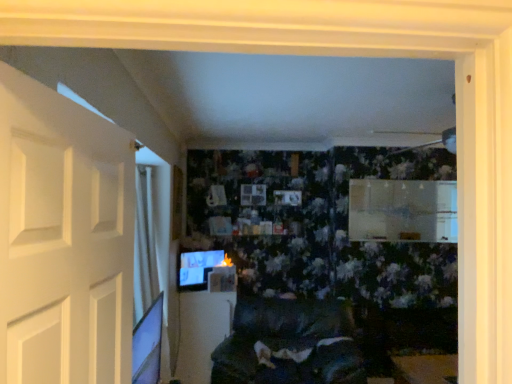
Question: From a real-world perspective, is white glossy table at center located beneath matte black monitor at lower left?

Choices:
 (A) yes
 (B) no

Answer: (A)

Question: Is white glossy table at center beside matte black monitor at lower left?

Choices:
 (A) no
 (B) yes

Answer: (A)

Question: Would you say white glossy table at center is a long distance from matte black monitor at lower left?

Choices:
 (A) yes
 (B) no

Answer: (B)

Question: Does white glossy table at center turn towards matte black monitor at lower left?

Choices:
 (A) yes
 (B) no

Answer: (B)

Question: Can you confirm if white glossy table at center is taller than matte black monitor at lower left?

Choices:
 (A) no
 (B) yes

Answer: (B)

Question: Relative to velvet dark gray couch at center, is matte black monitor at lower left in front or behind?

Choices:
 (A) behind
 (B) front

Answer: (A)

Question: In terms of size, does matte black monitor at lower left appear bigger or smaller than velvet dark gray couch at center?

Choices:
 (A) big
 (B) small

Answer: (B)

Question: Is matte black monitor at lower left taller or shorter than velvet dark gray couch at center?

Choices:
 (A) short
 (B) tall

Answer: (A)

Question: From a real-world perspective, relative to velvet dark gray couch at center, is matte black monitor at lower left vertically above or below?

Choices:
 (A) above
 (B) below

Answer: (A)

Question: In the image, is velvet dark gray couch at center on the left side or the right side of white glossy table at center?

Choices:
 (A) left
 (B) right

Answer: (B)

Question: Is point (244, 349) closer or farther from the camera than point (217, 301)?

Choices:
 (A) farther
 (B) closer

Answer: (B)

Question: From a real-world perspective, is velvet dark gray couch at center positioned above or below white glossy table at center?

Choices:
 (A) above
 (B) below

Answer: (B)

Question: Is velvet dark gray couch at center wider or thinner than white glossy table at center?

Choices:
 (A) thin
 (B) wide

Answer: (B)

Question: From a real-world perspective, relative to white matte door at left, is velvet dark gray couch at center vertically above or below?

Choices:
 (A) above
 (B) below

Answer: (B)

Question: Is velvet dark gray couch at center to the left or to the right of white matte door at left in the image?

Choices:
 (A) left
 (B) right

Answer: (B)